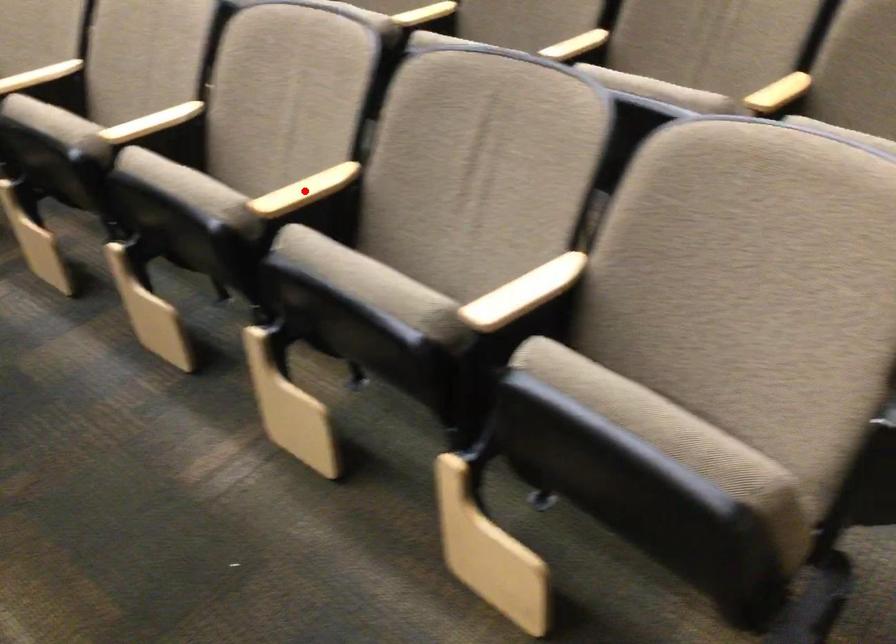
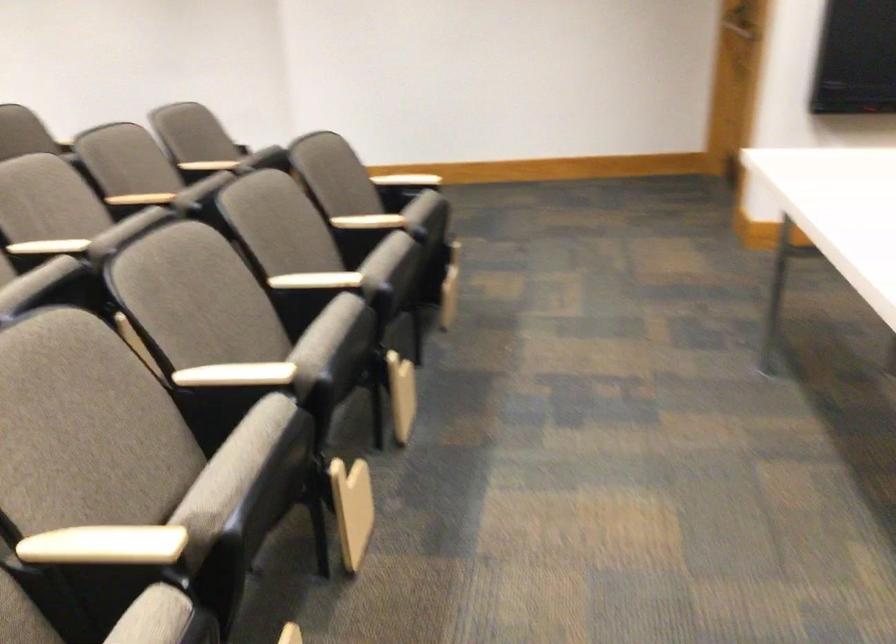
Question: I am providing you with two images of the same scene from different viewpoints. A red point is marked on the first image. At the location where the point appears in image 1, is it still visible in image 2?

Choices:
 (A) Yes
 (B) No

Answer: (B)